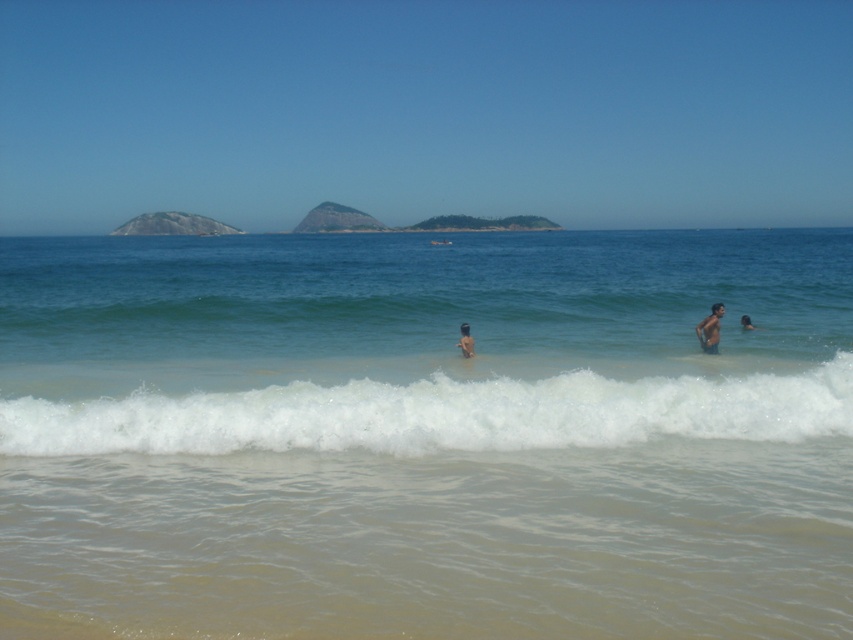
Question: Is white foamy wave at lower center in front of tan skin person at center?

Choices:
 (A) yes
 (B) no

Answer: (A)

Question: Is the position of white foamy wave at lower center less distant than that of tan skin human at right?

Choices:
 (A) no
 (B) yes

Answer: (B)

Question: Based on their relative distances, which object is nearer to the tan skin human at right?

Choices:
 (A) white foamy wave at lower center
 (B) skinny man at right

Answer: (B)

Question: Which of the following is the closest to the observer?

Choices:
 (A) (461, 337)
 (B) (718, 304)

Answer: (A)

Question: Which of the following is the farthest from the observer?

Choices:
 (A) clear blue water at center
 (B) tan skin person at center
 (C) white foamy wave at lower center
 (D) tan skin human at right

Answer: (D)

Question: Is clear blue water at center thinner than tan skin person at center?

Choices:
 (A) yes
 (B) no

Answer: (B)